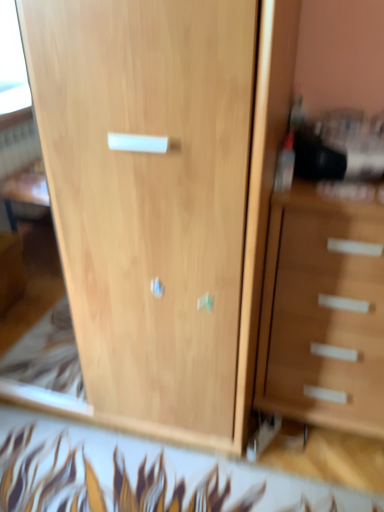
Question: From a real-world perspective, is light wood cupboard at center located higher than wooden chest of drawers at right?

Choices:
 (A) yes
 (B) no

Answer: (A)

Question: Can you confirm if light wood cupboard at center is bigger than wooden chest of drawers at right?

Choices:
 (A) yes
 (B) no

Answer: (A)

Question: From the image's perspective, does light wood cupboard at center appear lower than wooden chest of drawers at right?

Choices:
 (A) yes
 (B) no

Answer: (B)

Question: Would you consider light wood cupboard at center to be distant from wooden chest of drawers at right?

Choices:
 (A) no
 (B) yes

Answer: (A)

Question: Are light wood cupboard at center and wooden chest of drawers at right making contact?

Choices:
 (A) yes
 (B) no

Answer: (B)

Question: Is light wood cupboard at center at the left side of wooden chest of drawers at right?

Choices:
 (A) yes
 (B) no

Answer: (A)

Question: Is wooden chest of drawers at right at the left side of light wood cupboard at center?

Choices:
 (A) no
 (B) yes

Answer: (A)

Question: Can you confirm if wooden chest of drawers at right is shorter than light wood cupboard at center?

Choices:
 (A) yes
 (B) no

Answer: (A)

Question: Can you confirm if wooden chest of drawers at right is bigger than light wood cupboard at center?

Choices:
 (A) yes
 (B) no

Answer: (B)

Question: From a real-world perspective, is wooden chest of drawers at right positioned under light wood cupboard at center based on gravity?

Choices:
 (A) yes
 (B) no

Answer: (A)

Question: Is wooden chest of drawers at right at the right side of light wood cupboard at center?

Choices:
 (A) yes
 (B) no

Answer: (A)

Question: Considering the relative sizes of wooden chest of drawers at right and light wood cupboard at center in the image provided, is wooden chest of drawers at right smaller than light wood cupboard at center?

Choices:
 (A) no
 (B) yes

Answer: (B)

Question: Considering the positions of wooden chest of drawers at right and light wood cupboard at center in the image, is wooden chest of drawers at right wider or thinner than light wood cupboard at center?

Choices:
 (A) thin
 (B) wide

Answer: (A)